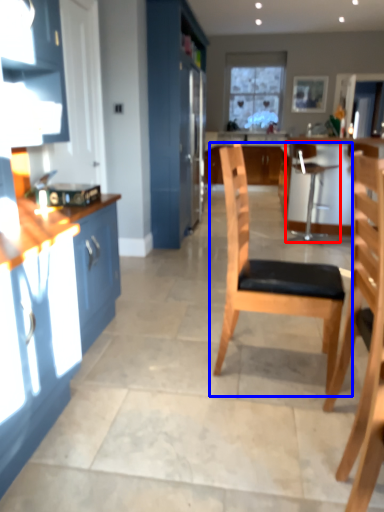
Question: Which object is closer to the camera taking this photo, chair (highlighted by a red box) or chair (highlighted by a blue box)?

Choices:
 (A) chair
 (B) chair

Answer: (B)